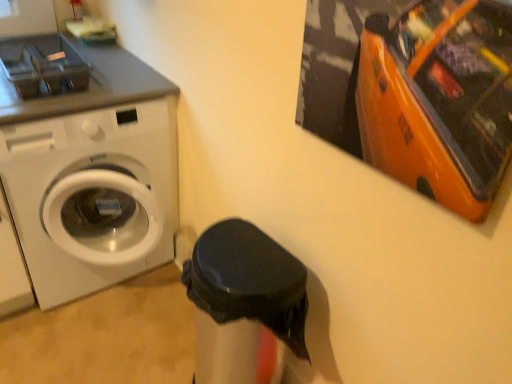
Question: Would you consider black matte trash can at center to be distant from white glossy washing machine at left?

Choices:
 (A) yes
 (B) no

Answer: (B)

Question: Is black matte trash can at center outside of white glossy washing machine at left?

Choices:
 (A) yes
 (B) no

Answer: (A)

Question: Is black matte trash can at center at the left side of white glossy washing machine at left?

Choices:
 (A) yes
 (B) no

Answer: (B)

Question: Is white glossy washing machine at left surrounded by black matte trash can at center?

Choices:
 (A) no
 (B) yes

Answer: (A)

Question: Can you confirm if black matte trash can at center is wider than white glossy washing machine at left?

Choices:
 (A) yes
 (B) no

Answer: (B)

Question: Is the depth of black matte trash can at center greater than that of white glossy washing machine at left?

Choices:
 (A) no
 (B) yes

Answer: (A)

Question: Is there a large distance between white glossy washing machine at left and black matte trash can at center?

Choices:
 (A) no
 (B) yes

Answer: (A)

Question: From a real-world perspective, is white glossy washing machine at left physically below black matte trash can at center?

Choices:
 (A) yes
 (B) no

Answer: (B)

Question: Would you say white glossy washing machine at left is outside black matte trash can at center?

Choices:
 (A) yes
 (B) no

Answer: (A)

Question: Is the depth of white glossy washing machine at left less than that of black matte trash can at center?

Choices:
 (A) yes
 (B) no

Answer: (B)

Question: Considering the relative positions of white glossy washing machine at left and black matte trash can at center in the image provided, is white glossy washing machine at left behind black matte trash can at center?

Choices:
 (A) yes
 (B) no

Answer: (A)

Question: From the image's perspective, is white glossy washing machine at left under black matte trash can at center?

Choices:
 (A) yes
 (B) no

Answer: (B)

Question: Would you say black matte trash can at center is to the left or to the right of white glossy washing machine at left in the picture?

Choices:
 (A) left
 (B) right

Answer: (B)